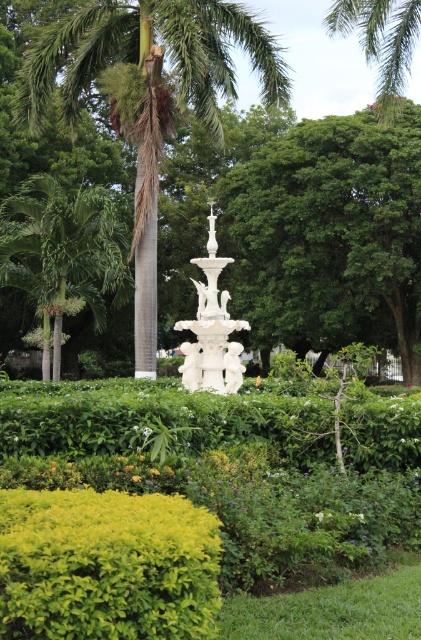
Which is above, green leafy palm tree at center or white marble fountain at center?

green leafy palm tree at center is higher up.

Which of these two, green leafy palm tree at center or white marble fountain at center, stands shorter?

white marble fountain at center is shorter.

What do you see at coordinates (146, 96) in the screenshot?
I see `green leafy palm tree at center` at bounding box center [146, 96].

I want to click on green leafy palm tree at center, so click(x=146, y=96).

Can you confirm if green leafy palm tree at center is positioned above green leafy palm at left?

Yes.

What are the coordinates of `green leafy palm tree at center` in the screenshot? It's located at (146, 96).

Between green leafy palm at upper right and white marble fountain at center, which one is positioned higher?

green leafy palm at upper right is higher up.

Can you confirm if green leafy palm at upper right is smaller than white marble fountain at center?

No.

At what (x,y) coordinates should I click in order to perform the action: click on green leafy palm at upper right. Please return your answer as a coordinate pair (x, y). Looking at the image, I should click on (381, 42).

Locate an element on the screen. The height and width of the screenshot is (640, 421). green leafy palm at upper right is located at coordinates (381, 42).